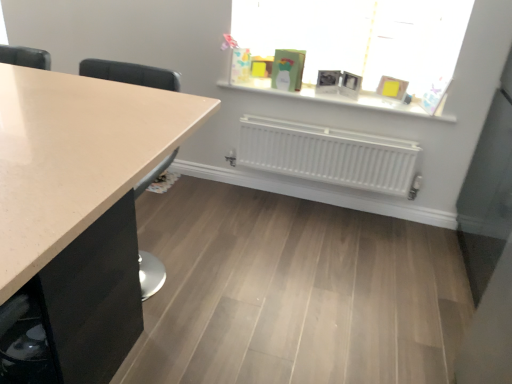
This screenshot has width=512, height=384. Identify the location of free spot above white matte window sill at upper center (from a real-world perspective). (351, 94).